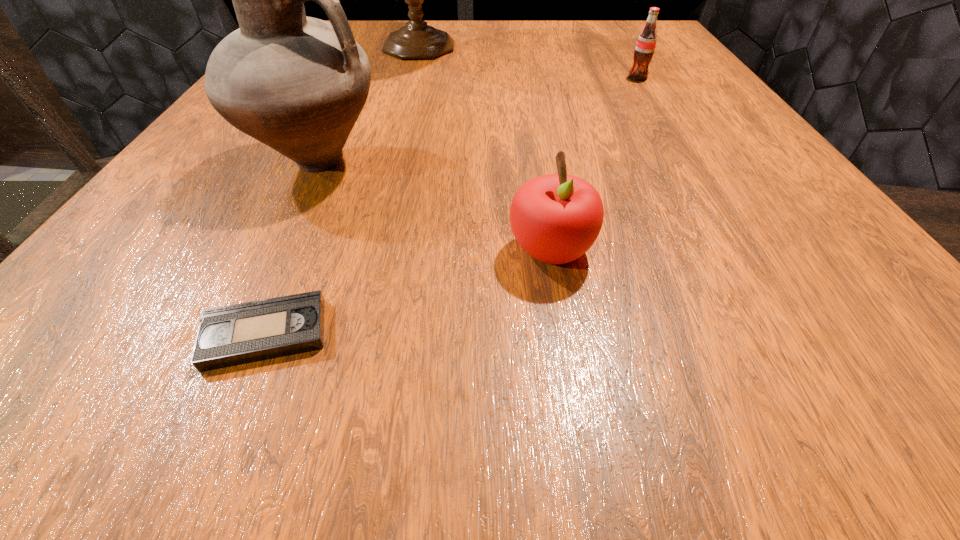
The width and height of the screenshot is (960, 540). I want to click on globe, so click(x=417, y=40).

Find the location of a particular element. Image resolution: width=960 pixels, height=540 pixels. the fourth shortest object is located at coordinates (298, 84).

Identify the location of pitcher. This screenshot has height=540, width=960. (298, 84).

I want to click on soda, so click(x=645, y=46).

Where is `the fourth object from left to right`? the fourth object from left to right is located at coordinates (556, 218).

Find the location of a particular element. The image size is (960, 540). the second nearest object is located at coordinates [x=556, y=218].

Identify the location of the nearest object. (236, 334).

You are a GUI agent. You are given a task and a screenshot of the screen. Output one action in this format:
    pyautogui.click(x=<x>, y=<y>)
    Task: Click on the videotape
    
    Given the screenshot: What is the action you would take?
    pyautogui.click(x=236, y=334)

Find the location of a particular element. free region located on the front of the globe showing Asia is located at coordinates (654, 48).

Locate an element on the screen. Image resolution: width=960 pixels, height=540 pixels. vacant space positioned on the handle side of the second tallest object is located at coordinates (476, 163).